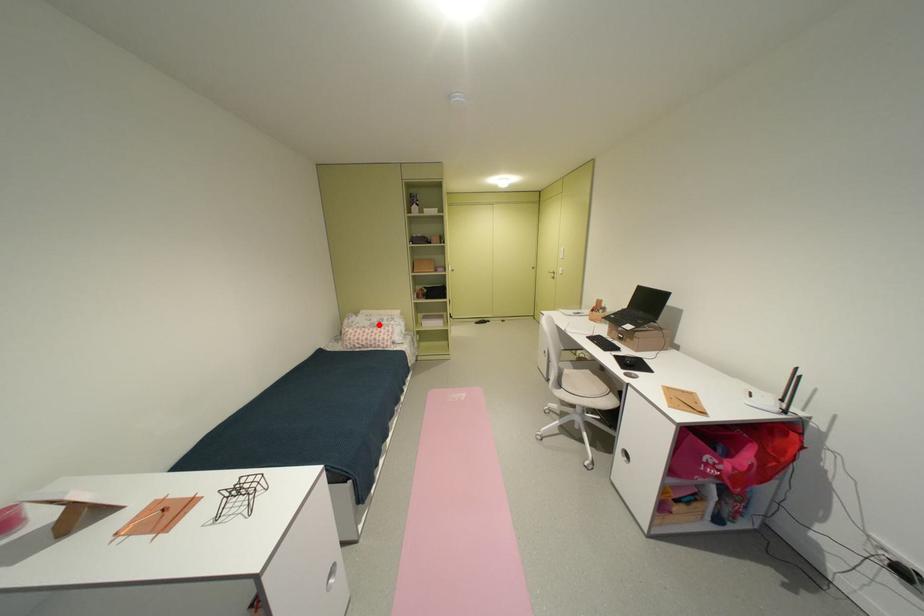
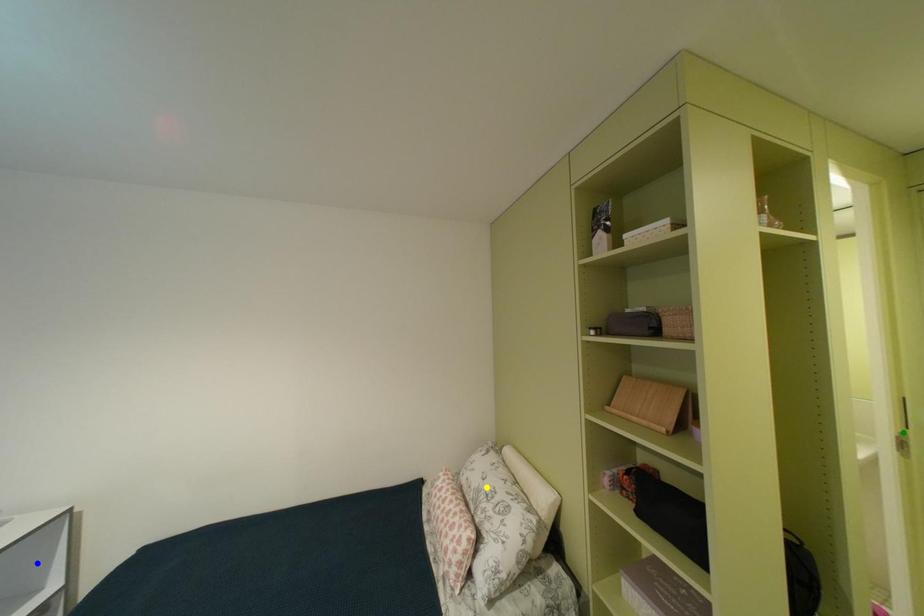
Question: I am providing you with two images of the same scene from different viewpoints. A red point is marked on the first image. You are given multiple points on the second image. Which spot in image 2 lines up with the point in image 1?

Choices:
 (A) yellow point
 (B) blue point
 (C) green point

Answer: (A)